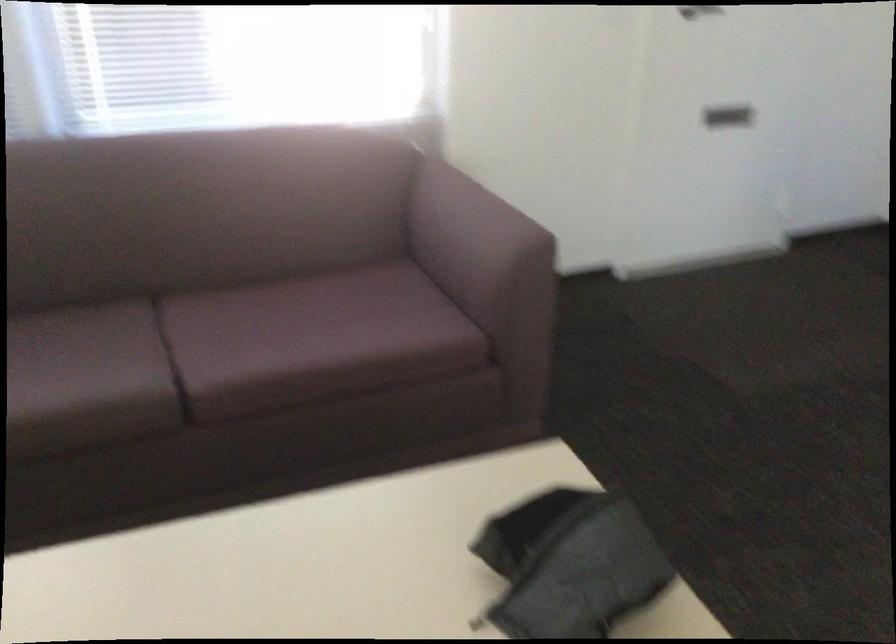
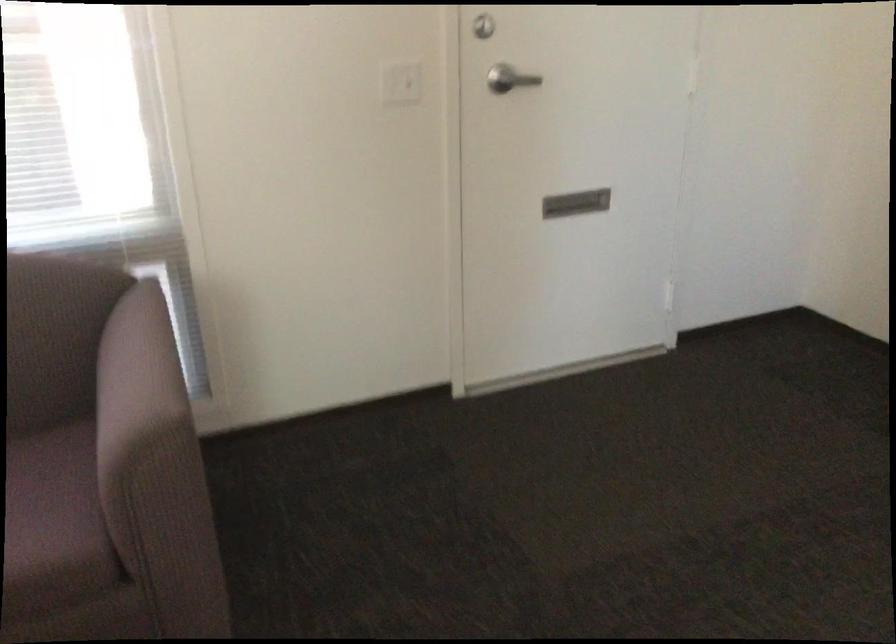
Which direction would the cameraman need to move to produce the second image?

The cameraman walked toward right, forward.